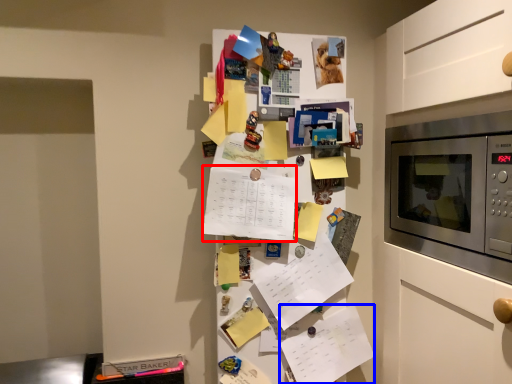
Question: Which object is further to the camera taking this photo, list (highlighted by a red box) or list (highlighted by a blue box)?

Choices:
 (A) list
 (B) list

Answer: (B)